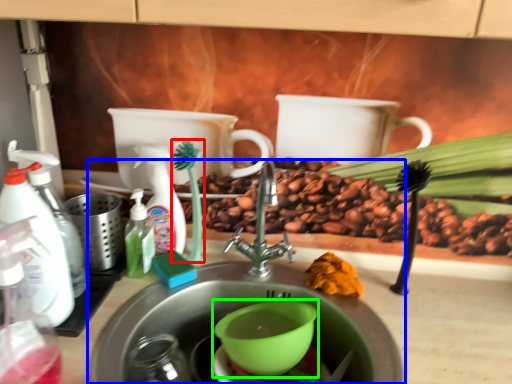
Question: Which is nearer to the plant (highlighted by a red box)? sink (highlighted by a blue box) or mixing bowl (highlighted by a green box).

Choices:
 (A) sink
 (B) mixing bowl

Answer: (A)